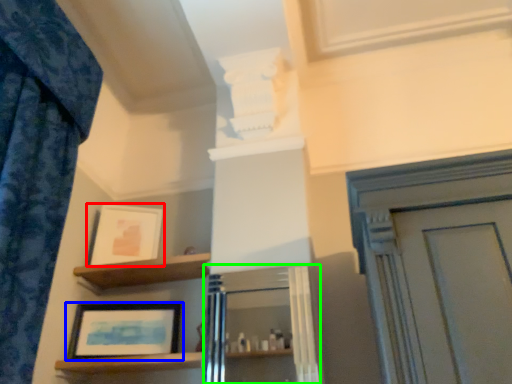
Question: Based on their relative distances, which object is nearer to picture frame (highlighted by a red box)? Choose from picture frame (highlighted by a blue box) and cabinetry (highlighted by a green box).

Choices:
 (A) picture frame
 (B) cabinetry

Answer: (A)